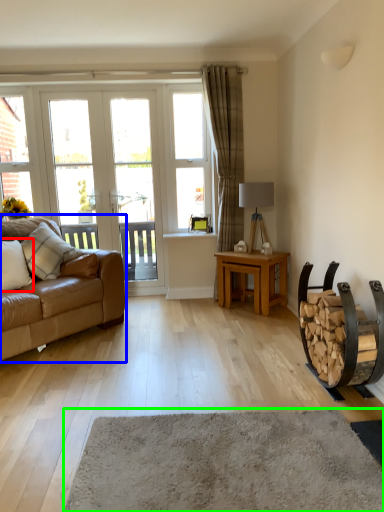
Question: Considering the real-world distances, which object is closest to pillow (highlighted by a red box)? studio couch (highlighted by a blue box) or plain (highlighted by a green box).

Choices:
 (A) studio couch
 (B) plain

Answer: (A)